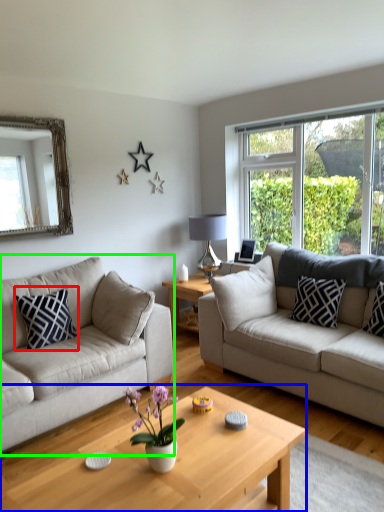
Question: Based on their relative distances, which object is nearer to pillow (highlighted by a red box)? Choose from coffee table (highlighted by a blue box) and studio couch (highlighted by a green box).

Choices:
 (A) coffee table
 (B) studio couch

Answer: (B)